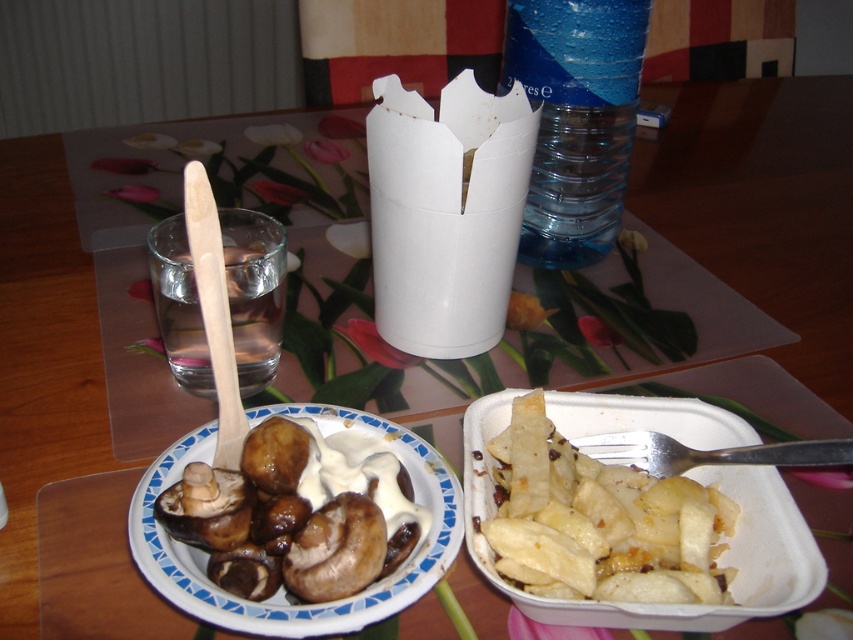
Is point (155, 499) farther from camera compared to point (685, 564)?

No, (155, 499) is in front of (685, 564).

Can you confirm if brown glossy mushrooms at left is wider than white matte potato wedges at lower right?

Incorrect, brown glossy mushrooms at left's width does not surpass white matte potato wedges at lower right's.

Does point (386, 525) come farther from viewer compared to point (625, 490)?

No, it is not.

The width and height of the screenshot is (853, 640). I want to click on brown glossy mushrooms at left, so click(x=294, y=515).

Does brown glossy mushrooms at left have a greater width compared to blue plastic bottle at upper center?

Correct, the width of brown glossy mushrooms at left exceeds that of blue plastic bottle at upper center.

Does point (352, 508) come farther from viewer compared to point (614, 102)?

No, (352, 508) is closer to viewer.

Is point (264, 490) in front of point (556, 125)?

That is True.

Locate an element on the screen. brown glossy mushrooms at left is located at coordinates (294, 515).

Measure the distance from white matte potato wedges at lower right to blue plastic bottle at upper center.

They are 9.74 inches apart.

Can you confirm if white matte potato wedges at lower right is bigger than blue plastic bottle at upper center?

Incorrect, white matte potato wedges at lower right is not larger than blue plastic bottle at upper center.

Find the location of `white matte potato wedges at lower right`. white matte potato wedges at lower right is located at coordinates (599, 522).

Locate an element on the screen. This screenshot has width=853, height=640. white matte potato wedges at lower right is located at coordinates click(599, 522).